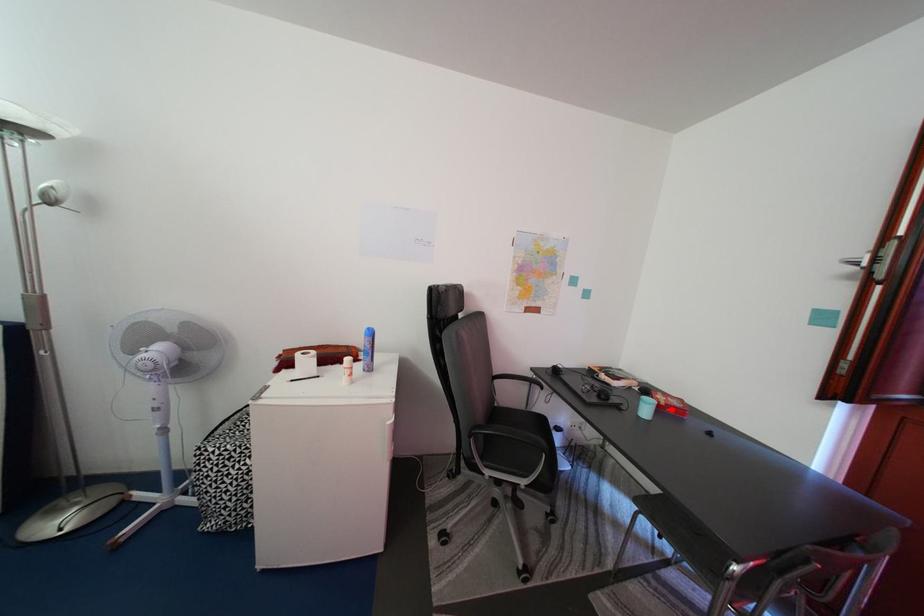
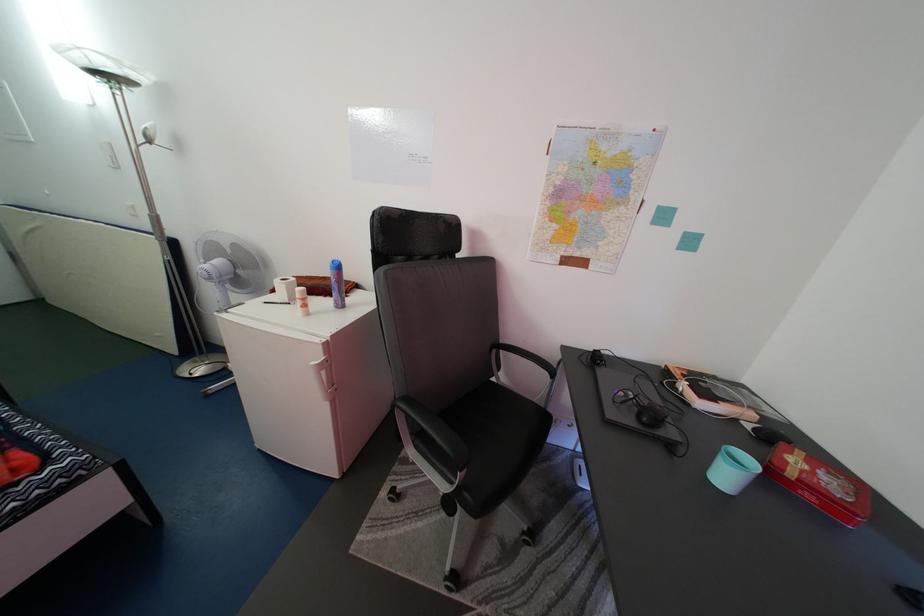
Find the pixel in the second image that matches the highlighted location in the first image.

(799, 480)